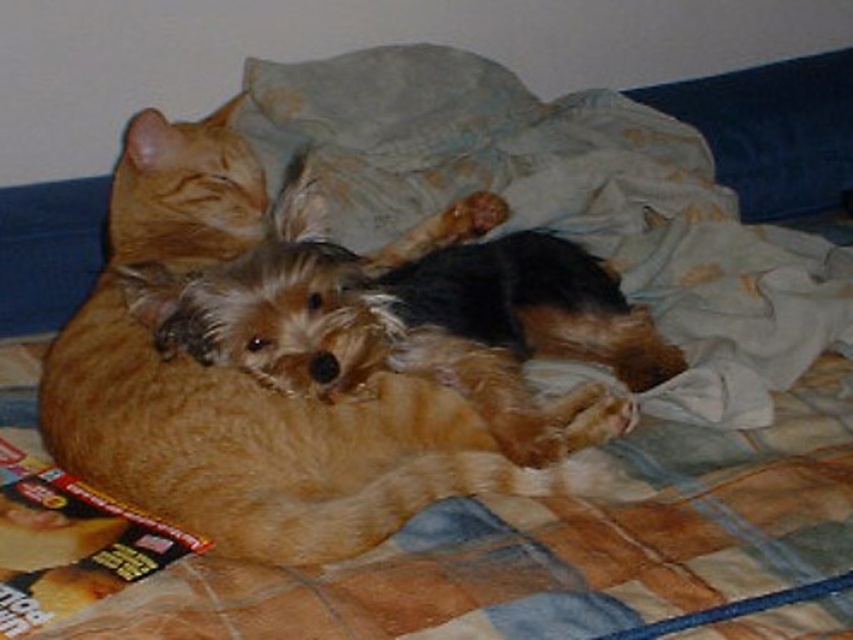
Question: Which point is closer to the camera?

Choices:
 (A) (299, 241)
 (B) (53, 540)
 (C) (744, 70)

Answer: (B)

Question: Which point is closer to the camera?

Choices:
 (A) matte plastic magazine at lower left
 (B) blue fabric pillow at upper right
 (C) fuzzy brown dog at center

Answer: (A)

Question: Is fuzzy brown dog at center below matte plastic magazine at lower left?

Choices:
 (A) yes
 (B) no

Answer: (B)

Question: Where is fuzzy brown dog at center located in relation to blue fabric pillow at upper right in the image?

Choices:
 (A) above
 (B) below

Answer: (B)

Question: Among these points, which one is nearest to the camera?

Choices:
 (A) (18, 465)
 (B) (463, 349)

Answer: (A)

Question: Does blue fabric pillow at upper right appear on the left side of matte plastic magazine at lower left?

Choices:
 (A) yes
 (B) no

Answer: (B)